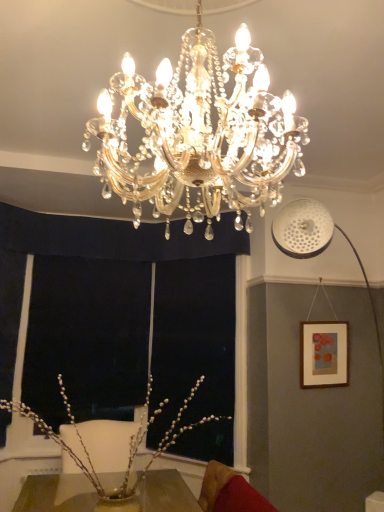
Question: Is there a large distance between wooden picture frame at right and gold crystal chandelier at center?

Choices:
 (A) no
 (B) yes

Answer: (B)

Question: From the image's perspective, is wooden picture frame at right located above gold crystal chandelier at center?

Choices:
 (A) yes
 (B) no

Answer: (B)

Question: From a real-world perspective, is wooden picture frame at right below gold crystal chandelier at center?

Choices:
 (A) no
 (B) yes

Answer: (B)

Question: Is wooden picture frame at right smaller than gold crystal chandelier at center?

Choices:
 (A) no
 (B) yes

Answer: (B)

Question: Is wooden picture frame at right outside gold crystal chandelier at center?

Choices:
 (A) no
 (B) yes

Answer: (B)

Question: Can gold crystal chandelier at center be found inside wooden picture frame at right?

Choices:
 (A) no
 (B) yes

Answer: (A)

Question: From a real-world perspective, is pearl-like branches at center located higher than wooden picture frame at right?

Choices:
 (A) no
 (B) yes

Answer: (A)

Question: Considering the relative sizes of pearl-like branches at center and wooden picture frame at right in the image provided, is pearl-like branches at center wider than wooden picture frame at right?

Choices:
 (A) yes
 (B) no

Answer: (A)

Question: Is pearl-like branches at center outside of wooden picture frame at right?

Choices:
 (A) yes
 (B) no

Answer: (A)

Question: Considering the relative sizes of pearl-like branches at center and wooden picture frame at right in the image provided, is pearl-like branches at center bigger than wooden picture frame at right?

Choices:
 (A) no
 (B) yes

Answer: (B)

Question: Is wooden picture frame at right inside pearl-like branches at center?

Choices:
 (A) no
 (B) yes

Answer: (A)

Question: Is pearl-like branches at center to the left of wooden picture frame at right from the viewer's perspective?

Choices:
 (A) yes
 (B) no

Answer: (A)

Question: Can you confirm if wooden picture frame at right is wider than velvet red swivel chair at lower right?

Choices:
 (A) no
 (B) yes

Answer: (A)